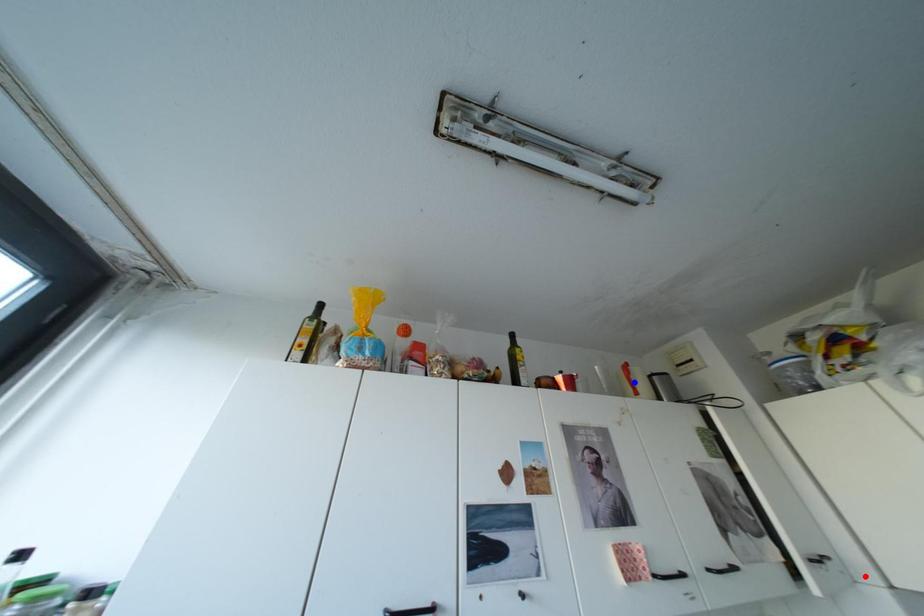
Question: Which of the two points in the image is closer to the camera?

Choices:
 (A) Blue point is closer.
 (B) Red point is closer.

Answer: (B)